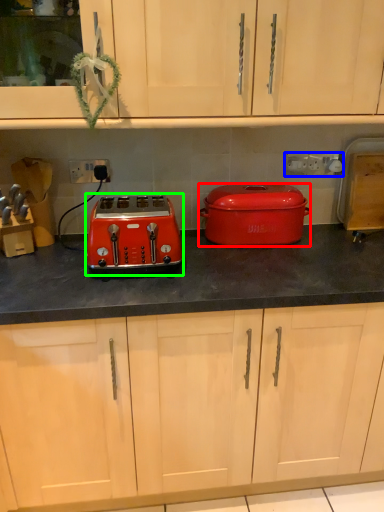
Question: Based on their relative distances, which object is nearer to kitchen appliance (highlighted by a red box)? Choose from electric outlet (highlighted by a blue box) and toaster (highlighted by a green box).

Choices:
 (A) electric outlet
 (B) toaster

Answer: (A)